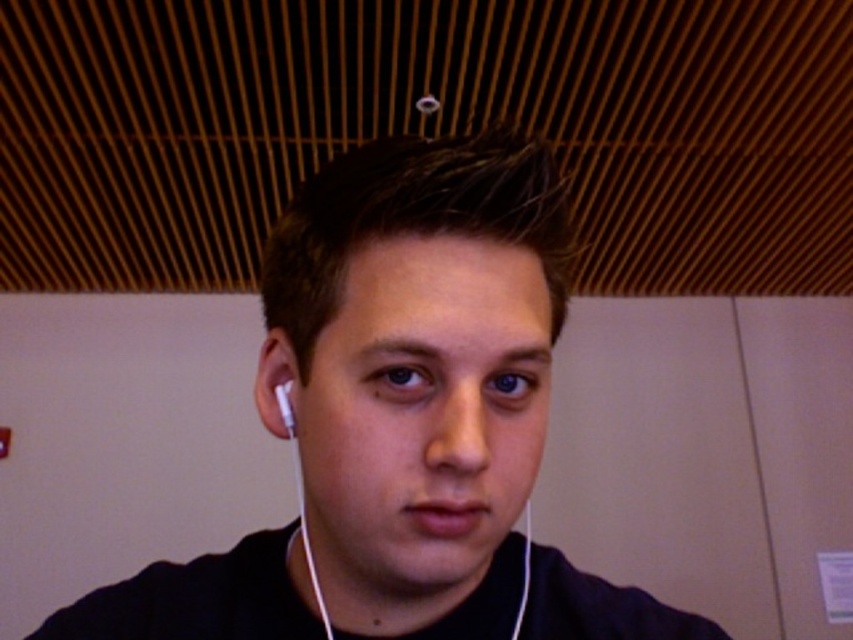
You are an interior designer planning to install a new light fixture in the room. The current light fixtures are located at point 0.5. Where should you place the new light fixture to avoid casting shadows on the black matte earphones at center?

The black matte earphones at center are positioned at point 0.583, so placing the new light fixture closer to point 0.5 would avoid casting shadows on them as it would be slightly offset from their location.

You are a photographer setting up a portrait shoot in a room with a wooden slatted ceiling. You notice two accessories on the subject, a white earbud at left and a white matte earphone at left. The client wants to know which one is wider. Can you determine which is wider based on their positions?

The white earbud at left is wider than the white matte earphone at left according to their width comparison.